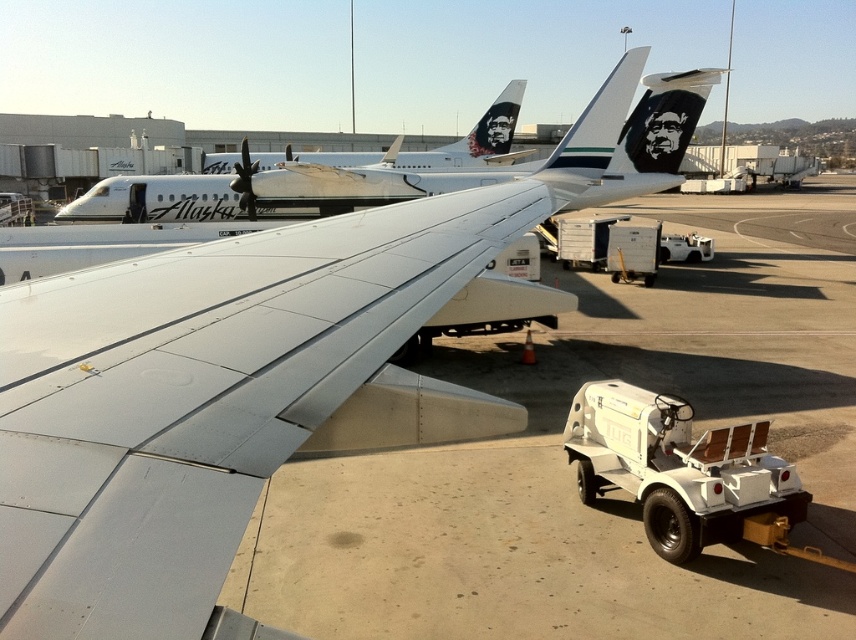
Is metallic gray wing at center smaller than white glossy airplane at upper left?

Indeed, metallic gray wing at center has a smaller size compared to white glossy airplane at upper left.

How far apart are metallic gray wing at center and white glossy airplane at upper left?

metallic gray wing at center and white glossy airplane at upper left are 13.81 meters apart.

Who is more distant from viewer, [376,266] or [144,208]?

The point [144,208] is behind.

At what (x,y) coordinates should I click in order to perform the action: click on metallic gray wing at center. Please return your answer as a coordinate pair (x, y). Looking at the image, I should click on (200, 397).

Is white matte tarmac at center closer to the viewer compared to white glossy airplane at upper center?

Yes, it is.

Is point (646, 616) positioned before point (462, 161)?

Yes, it is in front of point (462, 161).

Locate an element on the screen. This screenshot has width=856, height=640. white matte tarmac at center is located at coordinates click(571, 468).

From the picture: Can you confirm if white matte tarmac at center is positioned above white glossy airplane at upper left?

Actually, white matte tarmac at center is below white glossy airplane at upper left.

The width and height of the screenshot is (856, 640). What do you see at coordinates (571, 468) in the screenshot?
I see `white matte tarmac at center` at bounding box center [571, 468].

Find the location of a particular element. Image resolution: width=856 pixels, height=640 pixels. white matte tarmac at center is located at coordinates (571, 468).